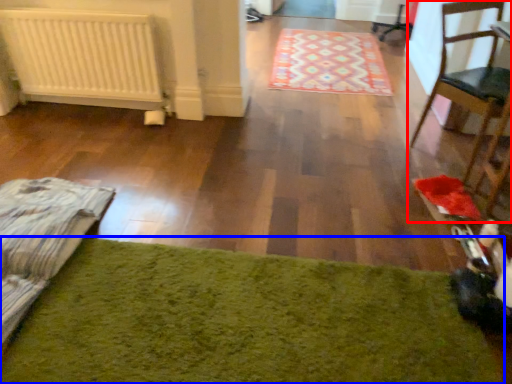
Question: Which object is closer to the camera taking this photo, chair (highlighted by a red box) or mat (highlighted by a blue box)?

Choices:
 (A) chair
 (B) mat

Answer: (B)